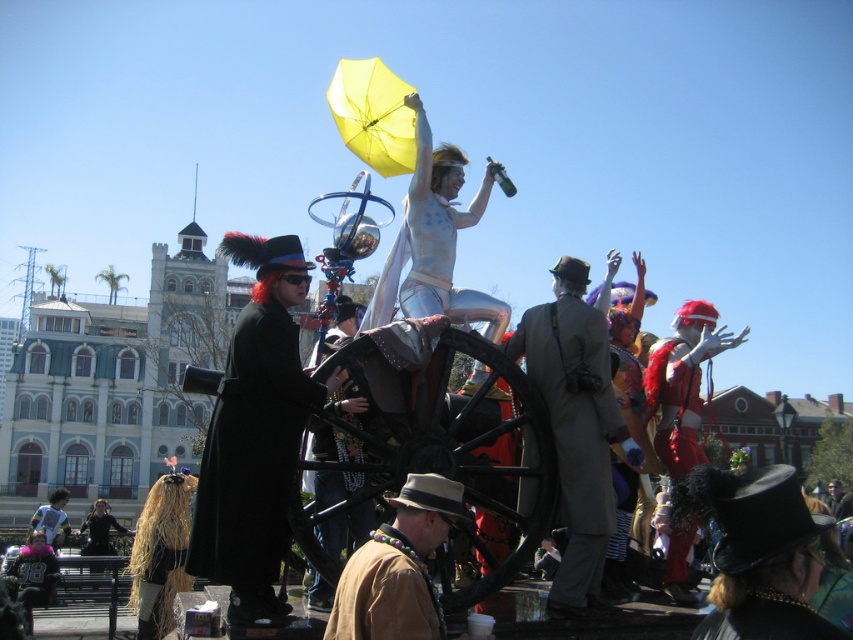
Between black matte coat at left and velvet red coat at center, which one has less height?

With less height is velvet red coat at center.

Can you confirm if black matte coat at left is taller than velvet red coat at center?

Yes, black matte coat at left is taller than velvet red coat at center.

Who is more distant from viewer, (252, 554) or (694, 374)?

Point (694, 374)

What are the coordinates of `black matte coat at left` in the screenshot? It's located at (252, 452).

Locate an element on the screen. gray wool coat at center is located at coordinates (575, 426).

This screenshot has width=853, height=640. What do you see at coordinates (575, 426) in the screenshot?
I see `gray wool coat at center` at bounding box center [575, 426].

The height and width of the screenshot is (640, 853). Identify the location of gray wool coat at center. (575, 426).

Does point (270, 312) come behind point (592, 596)?

Yes.

Who is more distant from viewer, (233, 372) or (573, 492)?

Positioned behind is point (573, 492).

Is point (288, 336) positioned behind point (556, 572)?

No, it is not.

Where is `black matte coat at left`? The width and height of the screenshot is (853, 640). black matte coat at left is located at coordinates (252, 452).